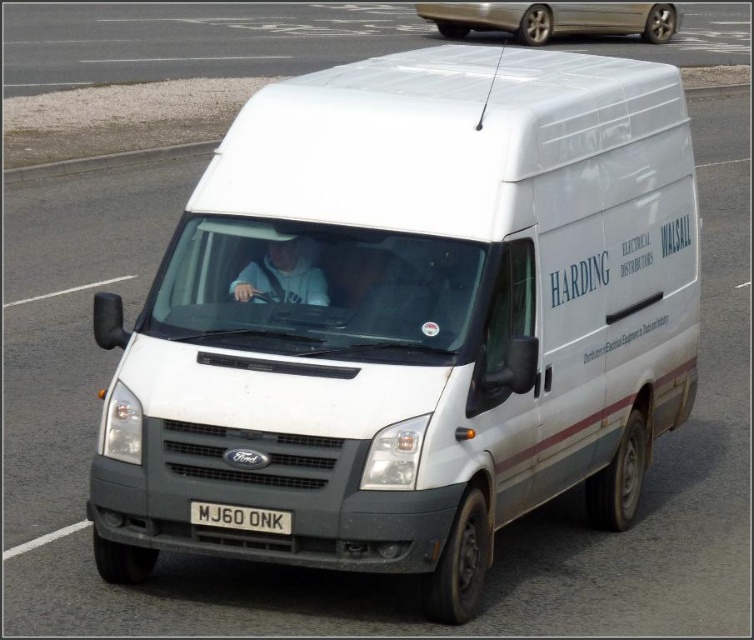
Question: Which point is farther from the camera taking this photo?

Choices:
 (A) (221, 512)
 (B) (607, 32)

Answer: (B)

Question: Does metallic silver sedan at upper center have a lesser width compared to white plastic license plate at center?

Choices:
 (A) no
 (B) yes

Answer: (A)

Question: Which point is farther from the camera taking this photo?

Choices:
 (A) (219, 516)
 (B) (610, 29)

Answer: (B)

Question: Can you confirm if metallic silver sedan at upper center is thinner than white plastic license plate at center?

Choices:
 (A) no
 (B) yes

Answer: (A)

Question: Considering the relative positions of metallic silver sedan at upper center and white plastic license plate at center in the image provided, where is metallic silver sedan at upper center located with respect to white plastic license plate at center?

Choices:
 (A) below
 (B) above

Answer: (B)

Question: Which point is farther from the camera taking this photo?

Choices:
 (A) (192, 515)
 (B) (495, 6)

Answer: (B)